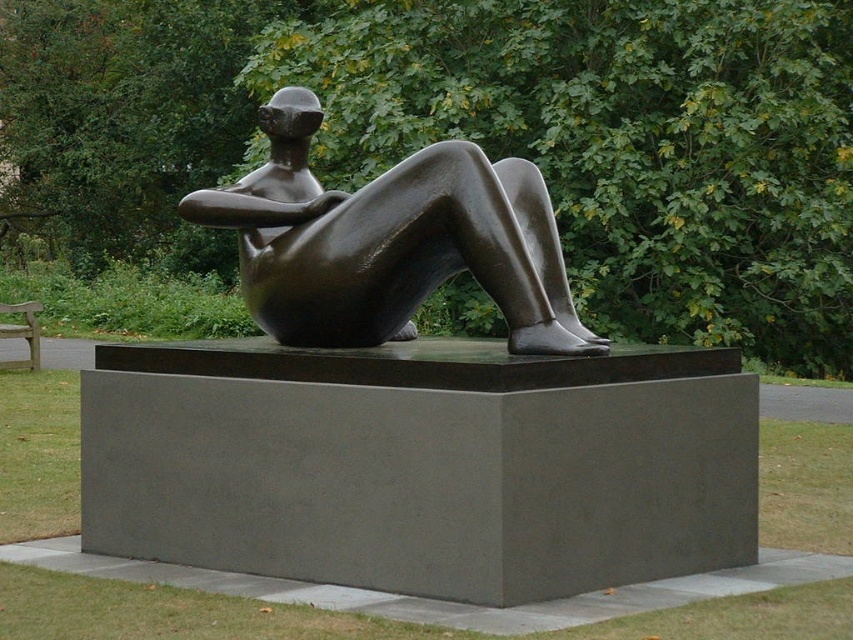
You are standing in front of the modern sculpture in the park. You notice two points marked on the sculpture. The first point is at coordinates point [222,195] and the second is at point [28,340]. From your current position, which point is closer to you?

Point [222,195] is in front of point [28,340], so the first point is closer to you.

You are a visitor at the park and want to take a photo of the bronze sculpture at center without including the wooden park bench at left in the frame. Is this possible based on their positions?

The bronze sculpture at center is positioned over the wooden park bench at left, so it is likely blocking the bench from view. Therefore, it should be possible to take a photo of the bronze sculpture at center without including the wooden park bench at left in the frame.

You are a photographer planning to take a photo of the bronze sculpture at center and the wooden park bench at left. If you want to ensure both objects are clearly visible in the frame, which one should you focus on first to avoid blurring?

You should focus on the bronze sculpture at center first because it has a larger size compared to the wooden park bench at left, making it more critical to capture details clearly.